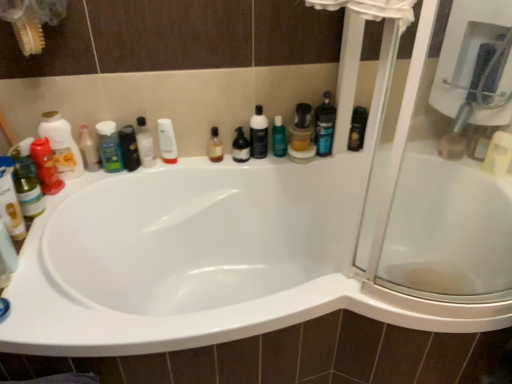
Describe the element at coordinates (324, 126) in the screenshot. This screenshot has height=384, width=512. I see `blue glossy bottle at upper right, which ranks as the 7th toiletry in left-to-right order` at that location.

Measure the distance between translucent plastic bottle at center, which appears as the 2th mouthwash when viewed from the right, and camera.

A distance of 1.58 meters exists between translucent plastic bottle at center, which appears as the 2th mouthwash when viewed from the right, and camera.

Identify the location of matte red bottle at left, the first cleaning product in the front-to-back sequence. This screenshot has width=512, height=384. (62, 145).

How much space does matte red bottle at left, marked as the 1th cleaning product in a left-to-right arrangement, occupy horizontally?

matte red bottle at left, marked as the 1th cleaning product in a left-to-right arrangement, is 3.72 inches in width.

You are a GUI agent. You are given a task and a screenshot of the screen. Output one action in this format:
    pyautogui.click(x=<x>, y=<y>)
    Task: Click on the black matte bottle at center, the first mouthwash viewed from the right
    The image size is (512, 384).
    Given the screenshot: What is the action you would take?
    pyautogui.click(x=259, y=134)

The image size is (512, 384). I want to click on the 2nd toiletry counting from the left of the blue glossy bottle at upper right, the second toiletry in the right-to-left sequence, so click(167, 141).

Between point (317, 119) and point (161, 141), which one is positioned in front?

Point (317, 119)

From the picture: Which of these two, blue glossy bottle at upper right, which ranks as the 7th toiletry in left-to-right order, or white glossy lotion at upper center, acting as the 5th toiletry starting from the left, is bigger?

blue glossy bottle at upper right, which ranks as the 7th toiletry in left-to-right order.

Are blue glossy bottle at upper right, the second toiletry in the right-to-left sequence, and white glossy lotion at upper center, arranged as the 4th toiletry when viewed from the right, located far from each other?

Actually, blue glossy bottle at upper right, the second toiletry in the right-to-left sequence, and white glossy lotion at upper center, arranged as the 4th toiletry when viewed from the right, are a little close together.

Is black matte bottle at center, the first mouthwash viewed from the right, turned away from white glossy bottle at upper center, marked as the fourth toiletry in a left-to-right arrangement?

No, white glossy bottle at upper center, marked as the fourth toiletry in a left-to-right arrangement, is not at the back of black matte bottle at center, the first mouthwash viewed from the right.

Is black matte bottle at center, the 3th mouthwash when ordered from left to right, to the right of white glossy bottle at upper center, which is counted as the fifth toiletry, starting from the right, from the viewer's perspective?

Yes.

Does point (264, 152) appear closer or farther from the camera than point (139, 133)?

Point (264, 152).

Is transparent plastic bottle at upper center, which ranks as the second cleaning product in left-to-right order, positioned with its back to white glossy lotion at upper center, acting as the 5th toiletry starting from the left?

That's not correct — transparent plastic bottle at upper center, which ranks as the second cleaning product in left-to-right order, is not looking away from white glossy lotion at upper center, acting as the 5th toiletry starting from the left.

This screenshot has height=384, width=512. I want to click on cleaning product behind the white glossy lotion at upper center, acting as the 5th toiletry starting from the left, so click(279, 138).

From a real-world perspective, is transparent plastic bottle at upper center, the first cleaning product positioned from the right, on white glossy lotion at upper center, acting as the 5th toiletry starting from the left?

Incorrect, from a real-world perspective, transparent plastic bottle at upper center, the first cleaning product positioned from the right, is lower than white glossy lotion at upper center, acting as the 5th toiletry starting from the left.

Does point (273, 131) come farther from viewer compared to point (169, 146)?

Yes.

Which is in front, point (110, 150) or point (332, 133)?

The point (110, 150) is closer to the camera.

Does green matte shampoo at left, positioned as the 3th toiletry in left-to-right order, have a greater width compared to blue glossy bottle at upper right, which ranks as the 7th toiletry in left-to-right order?

In fact, green matte shampoo at left, positioned as the 3th toiletry in left-to-right order, might be narrower than blue glossy bottle at upper right, which ranks as the 7th toiletry in left-to-right order.

Who is smaller, green matte shampoo at left, marked as the sixth toiletry in a right-to-left arrangement, or blue glossy bottle at upper right, the second toiletry in the right-to-left sequence?

green matte shampoo at left, marked as the sixth toiletry in a right-to-left arrangement, is smaller.

Could you tell me if translucent plastic bottle at left, which appears as the seventh toiletry when viewed from the right, is facing blue glossy bottle at upper right, the second toiletry in the right-to-left sequence?

No, translucent plastic bottle at left, which appears as the seventh toiletry when viewed from the right, is not turned towards blue glossy bottle at upper right, the second toiletry in the right-to-left sequence.

Based on the photo, in terms of size, does translucent plastic bottle at left, which is the second toiletry from left to right, appear bigger or smaller than blue glossy bottle at upper right, which ranks as the 7th toiletry in left-to-right order?

Considering their sizes, translucent plastic bottle at left, which is the second toiletry from left to right, takes up less space than blue glossy bottle at upper right, which ranks as the 7th toiletry in left-to-right order.

Is translucent plastic bottle at left, which is the second toiletry from left to right, not within blue glossy bottle at upper right, the second toiletry in the right-to-left sequence?

translucent plastic bottle at left, which is the second toiletry from left to right, lies outside blue glossy bottle at upper right, the second toiletry in the right-to-left sequence,'s area.

Which of these two, translucent plastic bottle at left, which is the second toiletry from left to right, or blue glossy bottle at upper right, which ranks as the 7th toiletry in left-to-right order, stands taller?

With more height is blue glossy bottle at upper right, which ranks as the 7th toiletry in left-to-right order.

Considering the sizes of objects translucent amber bottle at center, which appears as the 6th toiletry when viewed from the left, and transparent plastic bottle at upper center, the first cleaning product positioned from the right, in the image provided, who is shorter, translucent amber bottle at center, which appears as the 6th toiletry when viewed from the left, or transparent plastic bottle at upper center, the first cleaning product positioned from the right,?

Standing shorter between the two is translucent amber bottle at center, which appears as the 6th toiletry when viewed from the left.

Does translucent amber bottle at center, which appears as the 6th toiletry when viewed from the left, come in front of transparent plastic bottle at upper center, the first cleaning product positioned from the right?

Yes, translucent amber bottle at center, which appears as the 6th toiletry when viewed from the left, is closer to the camera.

Considering the relative sizes of translucent amber bottle at center, the 3th toiletry viewed from the right, and transparent plastic bottle at upper center, the first cleaning product positioned from the right, in the image provided, is translucent amber bottle at center, the 3th toiletry viewed from the right, thinner than transparent plastic bottle at upper center, the first cleaning product positioned from the right,?

No.

Is there a large distance between translucent amber bottle at center, which appears as the 6th toiletry when viewed from the left, and transparent plastic bottle at upper center, the first cleaning product positioned from the right?

They are positioned close to each other.

Who is shorter, white glossy bottle at upper center, which is counted as the fifth toiletry, starting from the right, or black matte bottle at center, the 3th mouthwash when ordered from left to right?

With less height is white glossy bottle at upper center, which is counted as the fifth toiletry, starting from the right.

Is white glossy bottle at upper center, which is counted as the fifth toiletry, starting from the right, spatially inside black matte bottle at center, the 3th mouthwash when ordered from left to right, or outside of it?

white glossy bottle at upper center, which is counted as the fifth toiletry, starting from the right, cannot be found inside black matte bottle at center, the 3th mouthwash when ordered from left to right.

Is white glossy bottle at upper center, marked as the fourth toiletry in a left-to-right arrangement, to the left or to the right of black matte bottle at center, the first mouthwash viewed from the right, in the image?

Clearly, white glossy bottle at upper center, marked as the fourth toiletry in a left-to-right arrangement, is on the left of black matte bottle at center, the first mouthwash viewed from the right, in the image.

From the picture: From the image's perspective, relative to black matte bottle at center, the first mouthwash viewed from the right, is white glossy bottle at upper center, which is counted as the fifth toiletry, starting from the right, above or below?

From the image's perspective, white glossy bottle at upper center, which is counted as the fifth toiletry, starting from the right, appears below black matte bottle at center, the first mouthwash viewed from the right.

The width and height of the screenshot is (512, 384). I want to click on the 2nd toiletry to the right when counting from the white glossy lotion at upper center, acting as the 5th toiletry starting from the left, so click(x=324, y=126).

From the image's perspective, starting from the black matte bottle at center, the 3th mouthwash when ordered from left to right, which toiletry is the 2nd one below? Please provide its 2D coordinates.

[(145, 144)]

Considering their positions, is white glossy bottle at upper center, marked as the fourth toiletry in a left-to-right arrangement, positioned further to black glossy bottle at upper left, which is the 1th mouthwash in left-to-right order, than translucent amber bottle at center, which appears as the 6th toiletry when viewed from the left?

The object further to black glossy bottle at upper left, which is the 1th mouthwash in left-to-right order, is translucent amber bottle at center, which appears as the 6th toiletry when viewed from the left.

Looking at this image, considering their positions, is green matte shampoo at left, marked as the sixth toiletry in a right-to-left arrangement, positioned further to translucent plastic bottle at center, which appears as the 2th mouthwash when viewed from the right, than translucent plastic bottle at left, which appears as the seventh toiletry when viewed from the right?

translucent plastic bottle at left, which appears as the seventh toiletry when viewed from the right, is further to translucent plastic bottle at center, which appears as the 2th mouthwash when viewed from the right.

Estimate the real-world distances between objects in this image. Which object is closer to blue glossy bottle at upper right, which ranks as the 7th toiletry in left-to-right order, transparent plastic bottle at upper center, the first cleaning product positioned from the right, or black matte bottle at center, the first mouthwash viewed from the right?

transparent plastic bottle at upper center, the first cleaning product positioned from the right, is closer to blue glossy bottle at upper right, which ranks as the 7th toiletry in left-to-right order.

Considering their positions, is transparent plastic bottle at upper center, the first cleaning product from the back, positioned further to white glossy lotion at upper center, arranged as the 4th toiletry when viewed from the right, than green matte shampoo at left, positioned as the 3th toiletry in left-to-right order?

transparent plastic bottle at upper center, the first cleaning product from the back, lies further to white glossy lotion at upper center, arranged as the 4th toiletry when viewed from the right, than the other object.

From the image, which object appears to be farther from black matte bottle at center, the first mouthwash viewed from the right, white glossy lotion at upper center, arranged as the 4th toiletry when viewed from the right, or matte red bottle at left, marked as the 1th cleaning product in a left-to-right arrangement?

matte red bottle at left, marked as the 1th cleaning product in a left-to-right arrangement, lies further to black matte bottle at center, the first mouthwash viewed from the right, than the other object.

Based on their spatial positions, is white glossy lotion at upper center, arranged as the 4th toiletry when viewed from the right, or matte red shampoo at left, acting as the first toiletry starting from the left, further from transparent plastic bottle at upper center, the first cleaning product positioned from the right?

The object further to transparent plastic bottle at upper center, the first cleaning product positioned from the right, is matte red shampoo at left, acting as the first toiletry starting from the left.

Based on their spatial positions, is green matte shampoo at left, marked as the sixth toiletry in a right-to-left arrangement, or blue glossy bottle at upper right, the second toiletry in the right-to-left sequence, closer to transparent plastic bottle at upper center, which ranks as the second cleaning product in left-to-right order?

Based on the image, blue glossy bottle at upper right, the second toiletry in the right-to-left sequence, appears to be nearer to transparent plastic bottle at upper center, which ranks as the second cleaning product in left-to-right order.

Estimate the real-world distances between objects in this image. Which object is further from white glossy bottle at upper center, which is counted as the fifth toiletry, starting from the right, translucent plastic bottle at left, which is the second toiletry from left to right, or green matte shampoo at left, marked as the sixth toiletry in a right-to-left arrangement?

Based on the image, translucent plastic bottle at left, which is the second toiletry from left to right, appears to be further to white glossy bottle at upper center, which is counted as the fifth toiletry, starting from the right.

The height and width of the screenshot is (384, 512). I want to click on toiletry between white glossy lotion at upper center, acting as the 5th toiletry starting from the left, and blue glossy bottle at upper right, which ranks as the 7th toiletry in left-to-right order, from left to right, so click(x=215, y=146).

Locate an element on the screen. Image resolution: width=512 pixels, height=384 pixels. cleaning product between matte red shampoo at left, acting as the first toiletry starting from the left, and translucent amber bottle at center, which appears as the 6th toiletry when viewed from the left is located at coordinates (62, 145).

Where is `cleaning product situated between matte red shampoo at left, acting as the first toiletry starting from the left, and green matte shampoo at left, marked as the sixth toiletry in a right-to-left arrangement, from left to right`? The height and width of the screenshot is (384, 512). cleaning product situated between matte red shampoo at left, acting as the first toiletry starting from the left, and green matte shampoo at left, marked as the sixth toiletry in a right-to-left arrangement, from left to right is located at coordinates (62, 145).

Identify the location of cleaning product between white glossy bottle at upper center, marked as the fourth toiletry in a left-to-right arrangement, and blue glossy bottle at upper right, which ranks as the 7th toiletry in left-to-right order. Image resolution: width=512 pixels, height=384 pixels. (279, 138).